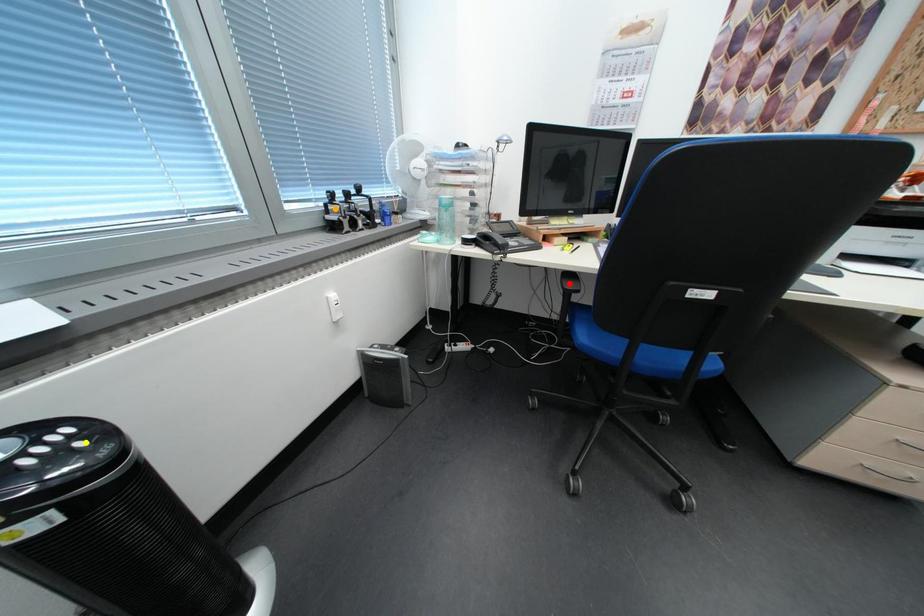
Order these from nearest to farthest:
A) yellow point
B) red point
C) orange point

yellow point, orange point, red point